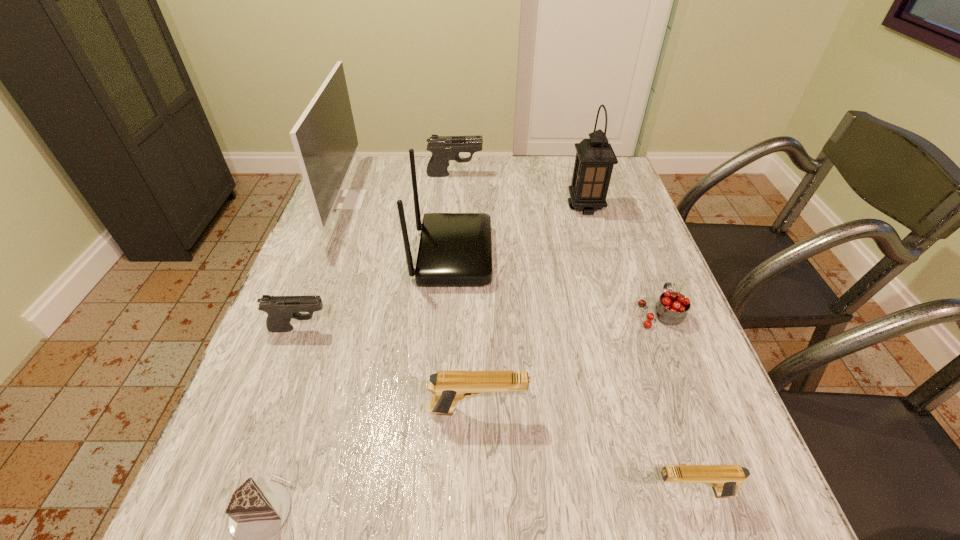
Image resolution: width=960 pixels, height=540 pixels. What are the coordinates of `monitor` in the screenshot? It's located at (324, 138).

Where is `lantern`? This screenshot has height=540, width=960. lantern is located at coordinates (595, 158).

Identify the location of router. This screenshot has height=540, width=960. (455, 249).

At what (x,y) coordinates should I click in order to perform the action: click on the farthest pistol. Please return your answer as a coordinate pair (x, y). This screenshot has height=540, width=960. Looking at the image, I should click on (443, 148).

Identify the location of the tallest pistol. The image size is (960, 540). (443, 148).

At what (x,y) coordinates should I click in order to perform the action: click on the left tan pistol. Please return your answer as a coordinate pair (x, y). Image resolution: width=960 pixels, height=540 pixels. Looking at the image, I should click on (449, 387).

The width and height of the screenshot is (960, 540). What are the coordinates of `the bigger tan pistol` in the screenshot? It's located at (449, 387).

Identify the location of the third nearest pistol. This screenshot has width=960, height=540. point(280,309).

Locate an element on the screen. This screenshot has width=960, height=540. the smaller black pistol is located at coordinates (280, 309).

Identify the location of cherry. This screenshot has width=960, height=540. (672, 308).